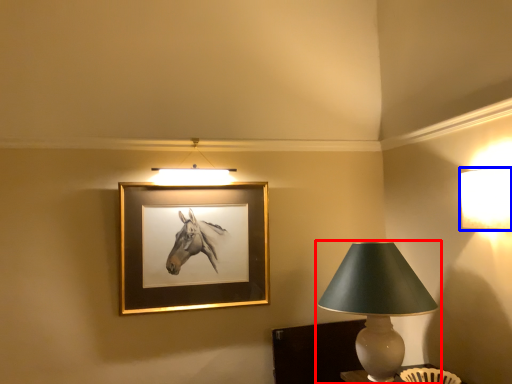
Question: Which point is closer to the camera, lamp (highlighted by a red box) or lamp (highlighted by a blue box)?

Choices:
 (A) lamp
 (B) lamp

Answer: (B)